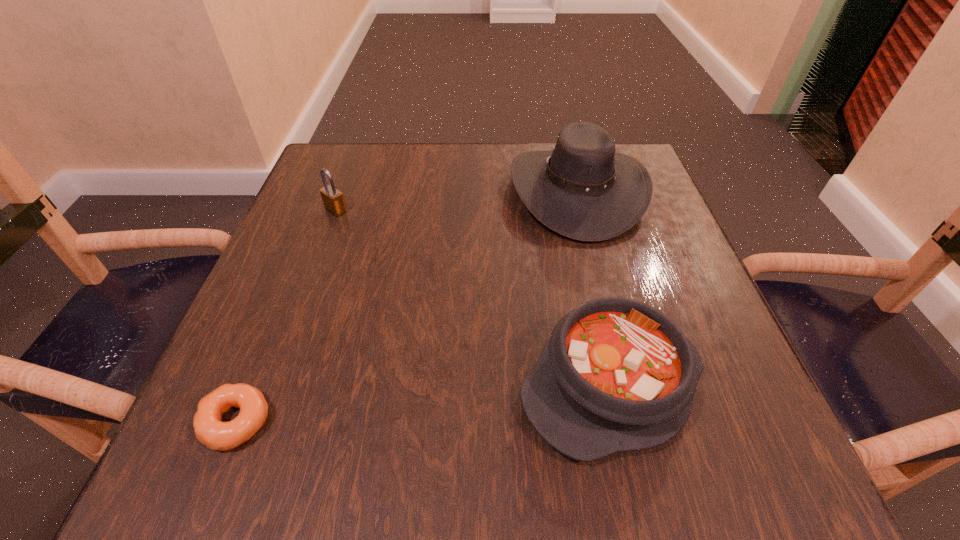
Where is `object that is positioned at the far edge`? This screenshot has height=540, width=960. object that is positioned at the far edge is located at coordinates (584, 190).

Image resolution: width=960 pixels, height=540 pixels. I want to click on casserole at the near edge, so click(616, 375).

You are a GUI agent. You are given a task and a screenshot of the screen. Output one action in this format:
    pyautogui.click(x=<x>, y=<y>)
    Task: Click on the doughnut present at the near edge
    The height and width of the screenshot is (540, 960).
    Given the screenshot: What is the action you would take?
    pyautogui.click(x=209, y=429)

Locate an element on the screen. padlock positioned at the left edge is located at coordinates (333, 200).

At what (x,y) coordinates should I click in order to perform the action: click on doughnut that is at the left edge. Please return your answer as a coordinate pair (x, y). Looking at the image, I should click on (209, 429).

At what (x,y) coordinates should I click in order to perform the action: click on cowboy hat situated at the right edge. Please return your answer as a coordinate pair (x, y). The image size is (960, 540). Looking at the image, I should click on (584, 190).

Locate an element on the screen. This screenshot has height=540, width=960. casserole at the right edge is located at coordinates (616, 375).

At what (x,y) coordinates should I click in order to perform the action: click on object at the near left corner. Please return your answer as a coordinate pair (x, y). Image resolution: width=960 pixels, height=540 pixels. Looking at the image, I should click on (209, 429).

Find the location of a particular element. The height and width of the screenshot is (540, 960). object at the far right corner is located at coordinates (584, 190).

Locate an element on the screen. The image size is (960, 540). object located in the near right corner section of the desktop is located at coordinates (616, 375).